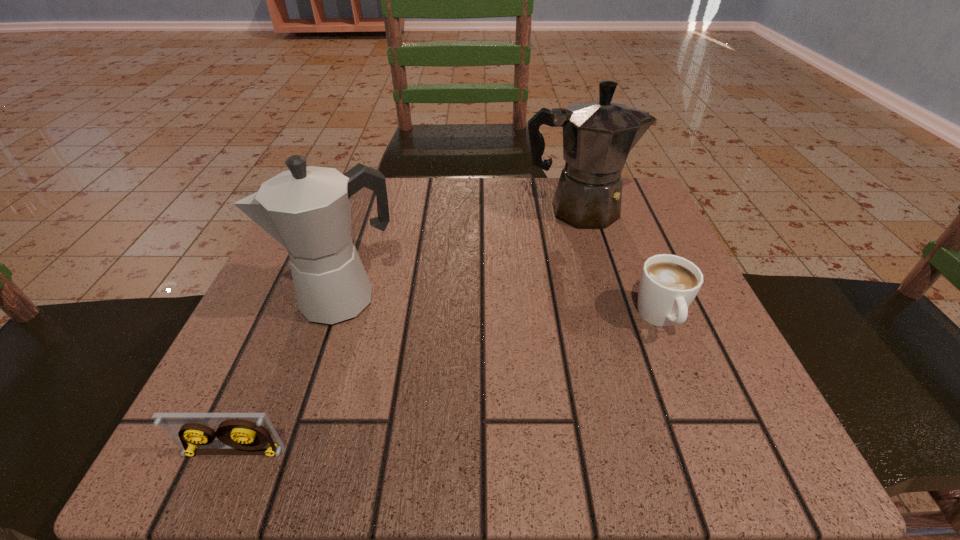
Identify the location of videotape at the left edge. The height and width of the screenshot is (540, 960). (239, 433).

The width and height of the screenshot is (960, 540). In order to click on coffeepot that is at the right edge in this screenshot , I will do `click(597, 135)`.

Where is `cappuccino that is at the right edge`? Image resolution: width=960 pixels, height=540 pixels. cappuccino that is at the right edge is located at coordinates 668,285.

At what (x,y) coordinates should I click in order to perform the action: click on object that is at the near left corner. Please return your answer as a coordinate pair (x, y). Image resolution: width=960 pixels, height=540 pixels. Looking at the image, I should click on (239, 433).

Locate an element on the screen. The width and height of the screenshot is (960, 540). object at the far right corner is located at coordinates (597, 135).

Find the location of a particular element. Image resolution: width=960 pixels, height=540 pixels. free space at the far edge is located at coordinates (470, 197).

In the image, there is a desktop. Identify the location of blank space at the near edge. (394, 412).

This screenshot has width=960, height=540. I want to click on vacant area at the left edge, so click(337, 335).

The image size is (960, 540). In the image, there is a desktop. In order to click on free region at the right edge in this screenshot , I will do `click(612, 314)`.

Where is `free space at the far right corner of the desktop`? This screenshot has width=960, height=540. free space at the far right corner of the desktop is located at coordinates (646, 197).